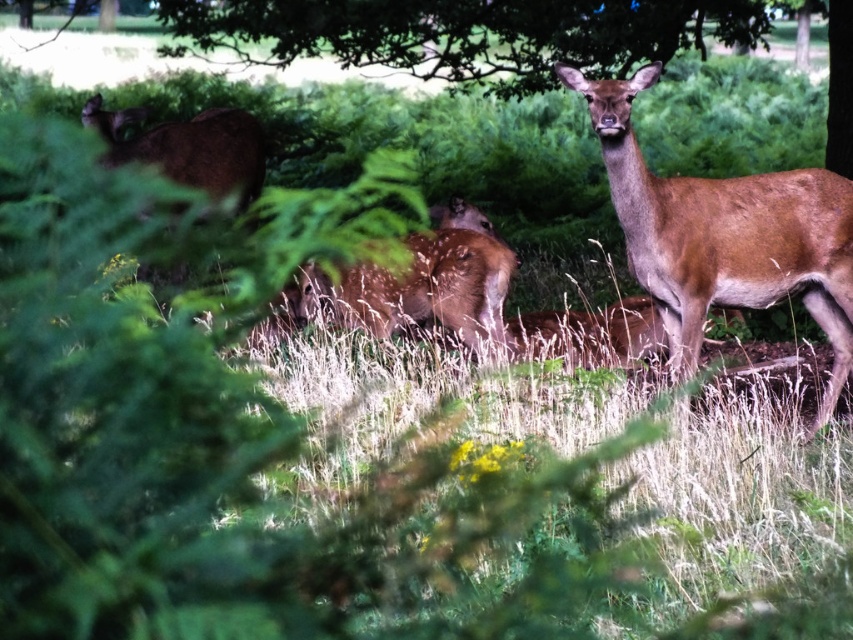
Is green leafy tree at upper center behind brown fur deer at center?

Yes, green leafy tree at upper center is further from the viewer.

Describe the element at coordinates (468, 35) in the screenshot. I see `green leafy tree at upper center` at that location.

This screenshot has width=853, height=640. What are the coordinates of `green leafy tree at upper center` in the screenshot? It's located at pos(468,35).